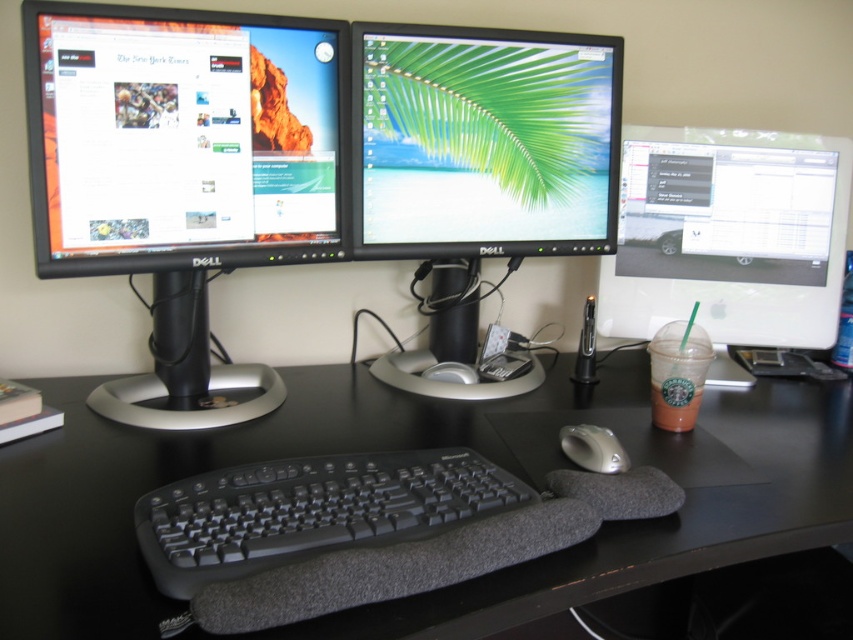
Which is in front, point (3, 588) or point (262, 192)?

Positioned in front is point (3, 588).

Locate an element on the screen. Image resolution: width=853 pixels, height=640 pixels. black matte desk at center is located at coordinates (223, 467).

I want to click on black matte desk at center, so click(x=223, y=467).

Can you confirm if black glossy monitor at center is positioned to the right of black rubberized keyboard at center?

Correct, you'll find black glossy monitor at center to the right of black rubberized keyboard at center.

Does black glossy monitor at center have a larger size compared to black rubberized keyboard at center?

Indeed, black glossy monitor at center has a larger size compared to black rubberized keyboard at center.

Locate an element on the screen. The image size is (853, 640). black glossy monitor at center is located at coordinates (483, 141).

You are a GUI agent. You are given a task and a screenshot of the screen. Output one action in this format:
    pyautogui.click(x=<x>, y=<y>)
    Task: Click on the black glossy monitor at center
    
    Given the screenshot: What is the action you would take?
    pyautogui.click(x=483, y=141)

Is point (492, 387) behind point (630, 337)?

No, (492, 387) is closer to viewer.

Does point (573, 244) lie behind point (601, 268)?

No, it is not.

Locate an element on the screen. Image resolution: width=853 pixels, height=640 pixels. black glossy monitor at center is located at coordinates (483, 141).